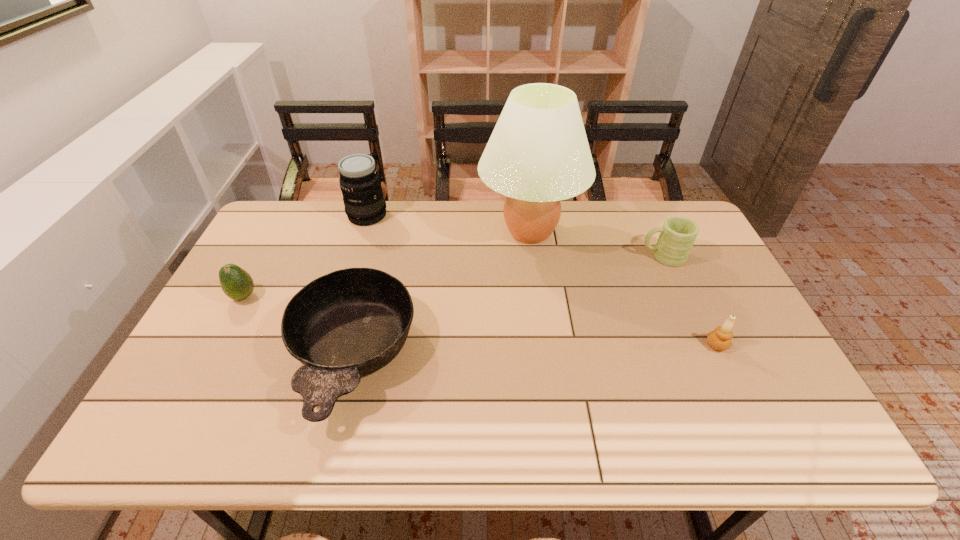
The width and height of the screenshot is (960, 540). I want to click on vacant area between the mug and the avocado, so coord(453,276).

Locate an element on the screen. The width and height of the screenshot is (960, 540). unoccupied area between the leftmost object and the candle_holder is located at coordinates (481, 321).

Locate an element on the screen. Image resolution: width=960 pixels, height=540 pixels. blank region between the avocado and the mug is located at coordinates (453, 276).

Image resolution: width=960 pixels, height=540 pixels. In order to click on empty space that is in between the frying pan and the candle_holder in this screenshot , I will do `click(535, 351)`.

Locate an element on the screen. The image size is (960, 540). vacant space in between the frying pan and the candle_holder is located at coordinates (535, 351).

This screenshot has width=960, height=540. What are the coordinates of `object that is the fifth closest to the mug` in the screenshot? It's located at (236, 283).

Identify the location of object that stands as the third closest to the tallest object. The width and height of the screenshot is (960, 540). (360, 183).

Image resolution: width=960 pixels, height=540 pixels. Find the location of `vacant space that satisfies the following two spatial constraints: 1. on the shade of the lampshade; 2. with the handle extending from the side of the frying pan`. vacant space that satisfies the following two spatial constraints: 1. on the shade of the lampshade; 2. with the handle extending from the side of the frying pan is located at coordinates (546, 357).

Find the location of a particular element. This screenshot has height=540, width=960. free spot that satisfies the following two spatial constraints: 1. on the shade of the candle_holder; 2. on the left side of the lampshade is located at coordinates (545, 345).

This screenshot has width=960, height=540. I want to click on vacant space that satisfies the following two spatial constraints: 1. on the shade of the lampshade; 2. on the right side of the candle_holder, so click(x=545, y=345).